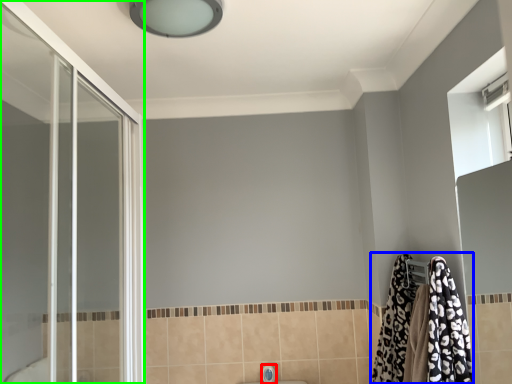
Question: Based on their relative distances, which object is farther from faucet (highlighted by a red box)? Choose from bathrobe (highlighted by a blue box) and screen door (highlighted by a green box).

Choices:
 (A) bathrobe
 (B) screen door

Answer: (B)